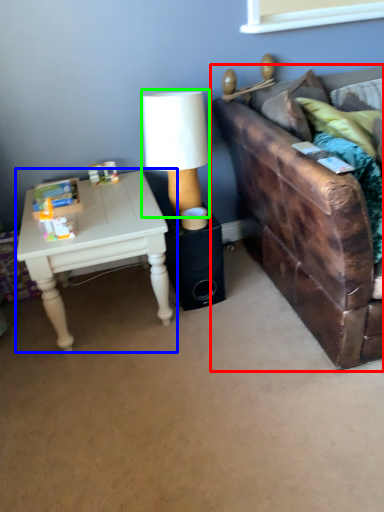
Question: Which object is positioned farthest from studio couch (highlighted by a red box)? Select from table (highlighted by a blue box) and table lamp (highlighted by a green box).

Choices:
 (A) table
 (B) table lamp

Answer: (A)